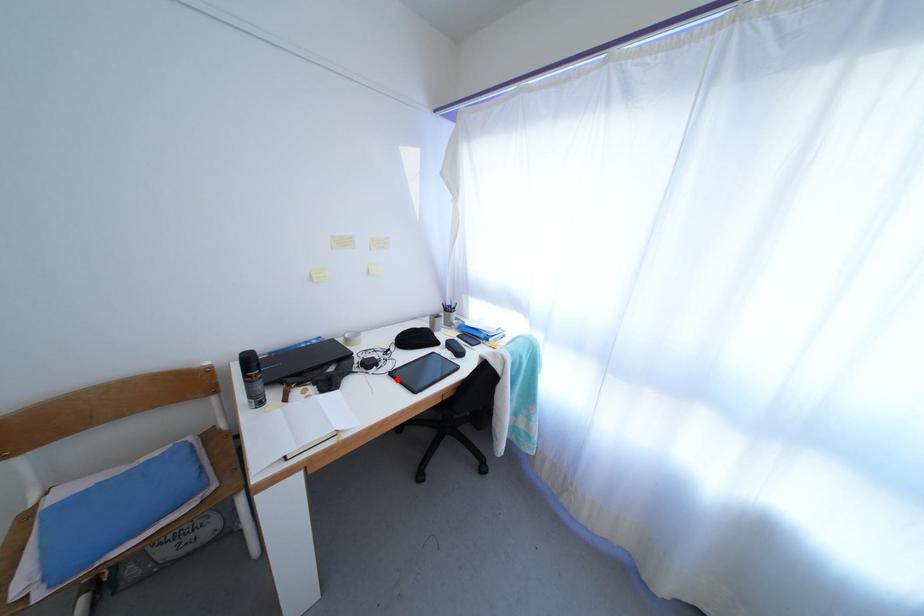
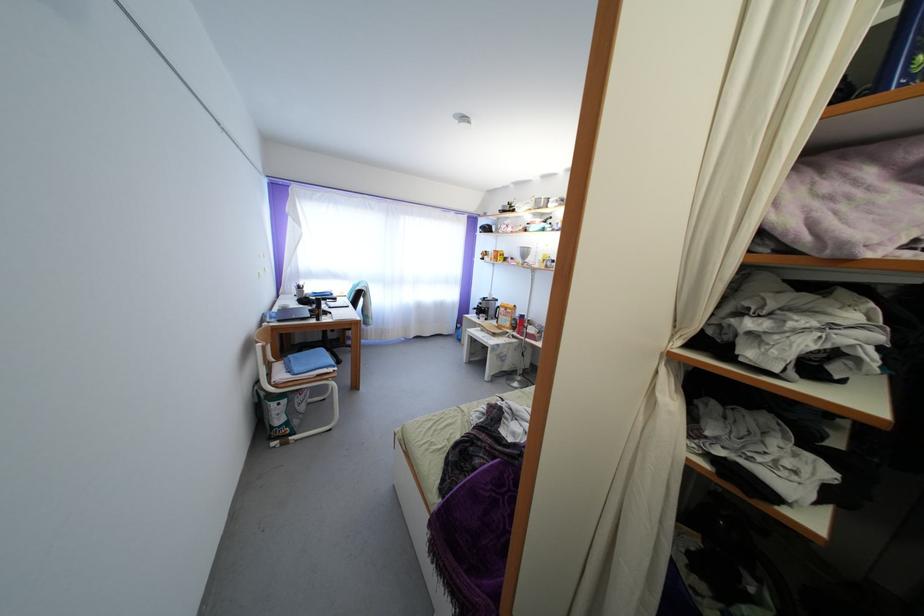
Question: I am providing you with two images of the same scene from different viewpoints. A red point is marked on the first image. Is the red point's position out of view in image 2?

Choices:
 (A) Yes
 (B) No

Answer: (A)